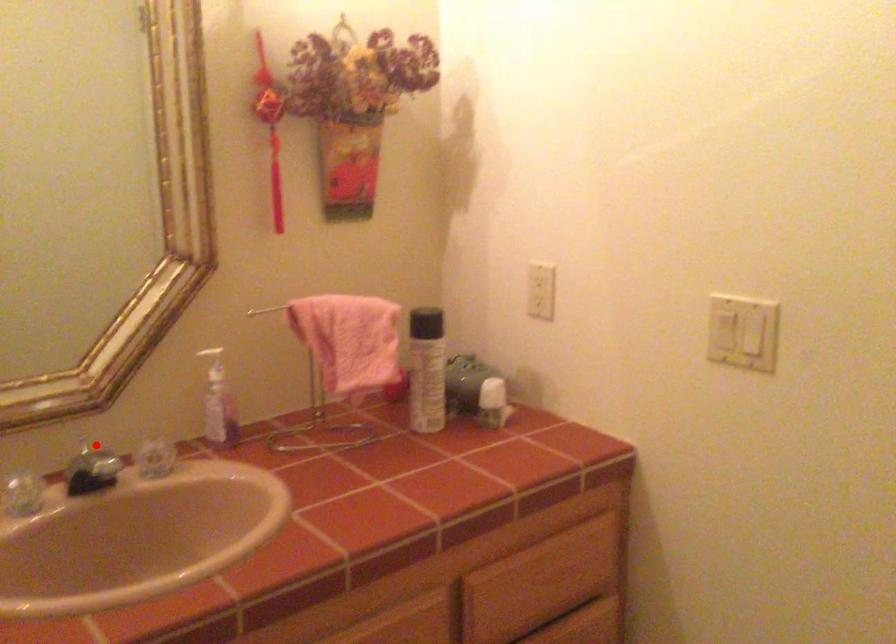
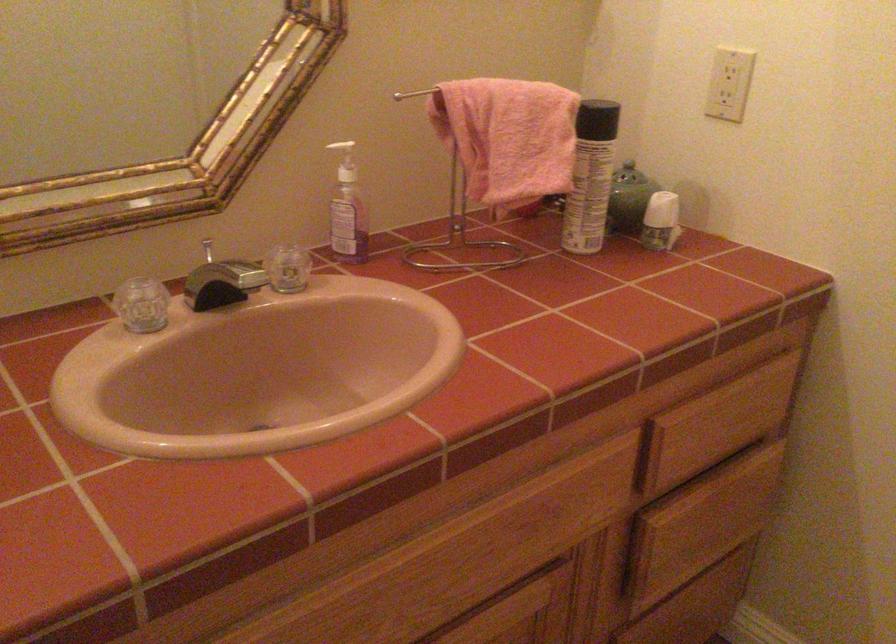
The point at the highlighted location is marked in the first image. Where is the corresponding point in the second image?

(208, 250)